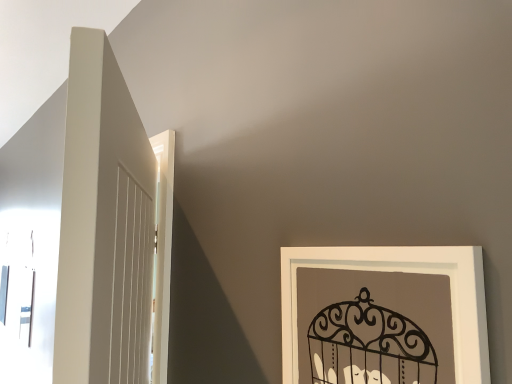
Question: Should I look upward or downward to see white matte picture frame at lower right?

Choices:
 (A) up
 (B) down

Answer: (B)